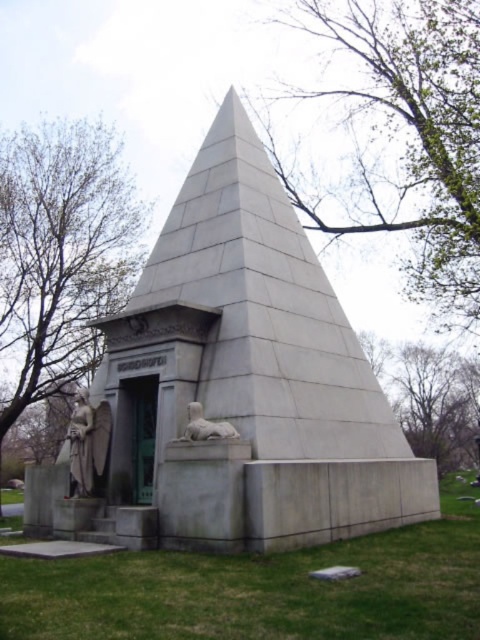
Who is positioned more to the right, green leafy tree at upper center or green leafy tree at left?

Positioned to the right is green leafy tree at upper center.

Can you confirm if green leafy tree at upper center is bigger than green leafy tree at left?

Indeed, green leafy tree at upper center has a larger size compared to green leafy tree at left.

Between point (469, 269) and point (75, 161), which one is positioned in front?

Point (469, 269)

Where is `green leafy tree at upper center`? green leafy tree at upper center is located at coordinates (402, 140).

Between green leafy tree at upper center and gray stone lion at lower center, which one is positioned lower?

gray stone lion at lower center

Between green leafy tree at upper center and gray stone lion at lower center, which one has more height?

green leafy tree at upper center is taller.

Find the location of `green leafy tree at upper center`. green leafy tree at upper center is located at coordinates (402, 140).

In order to click on green leafy tree at upper center in this screenshot , I will do `click(402, 140)`.

Does green leafy tree at left come in front of white marble statue at lower left?

No, it is not.

Can you confirm if green leafy tree at left is smaller than white marble statue at lower left?

No, green leafy tree at left is not smaller than white marble statue at lower left.

The height and width of the screenshot is (640, 480). What do you see at coordinates (60, 256) in the screenshot? I see `green leafy tree at left` at bounding box center [60, 256].

Locate an element on the screen. Image resolution: width=480 pixels, height=640 pixels. green leafy tree at left is located at coordinates (60, 256).